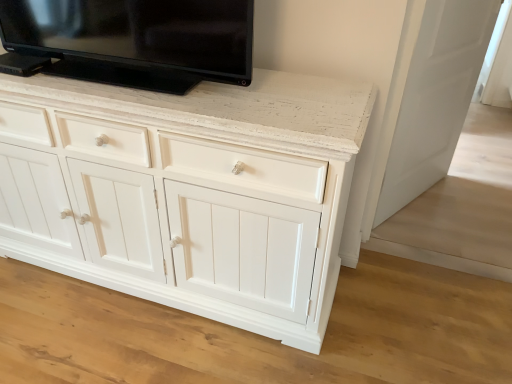
Question: Considering the relative sizes of white glossy door at right and black glossy tv at upper center in the image provided, is white glossy door at right shorter than black glossy tv at upper center?

Choices:
 (A) yes
 (B) no

Answer: (B)

Question: From a real-world perspective, is white glossy door at right positioned under black glossy tv at upper center based on gravity?

Choices:
 (A) no
 (B) yes

Answer: (B)

Question: Can you confirm if white glossy door at right is positioned to the left of black glossy tv at upper center?

Choices:
 (A) no
 (B) yes

Answer: (A)

Question: Could you tell me if white glossy door at right is turned towards black glossy tv at upper center?

Choices:
 (A) no
 (B) yes

Answer: (A)

Question: Does white glossy door at right lie behind black glossy tv at upper center?

Choices:
 (A) no
 (B) yes

Answer: (B)

Question: Can you confirm if white glossy door at right is smaller than black glossy tv at upper center?

Choices:
 (A) no
 (B) yes

Answer: (A)

Question: From a real-world perspective, is black glossy tv at upper center beneath white glossy door at right?

Choices:
 (A) no
 (B) yes

Answer: (A)

Question: Does black glossy tv at upper center touch white glossy door at right?

Choices:
 (A) no
 (B) yes

Answer: (A)

Question: Is black glossy tv at upper center thinner than white glossy door at right?

Choices:
 (A) yes
 (B) no

Answer: (B)

Question: Is black glossy tv at upper center facing away from white glossy door at right?

Choices:
 (A) yes
 (B) no

Answer: (B)

Question: Considering the relative positions of black glossy tv at upper center and white glossy door at right in the image provided, is black glossy tv at upper center in front of white glossy door at right?

Choices:
 (A) yes
 (B) no

Answer: (A)

Question: From the image's perspective, is black glossy tv at upper center above white glossy door at right?

Choices:
 (A) no
 (B) yes

Answer: (B)

Question: In terms of height, does black glossy tv at upper center look taller or shorter compared to white glossy door at right?

Choices:
 (A) short
 (B) tall

Answer: (A)